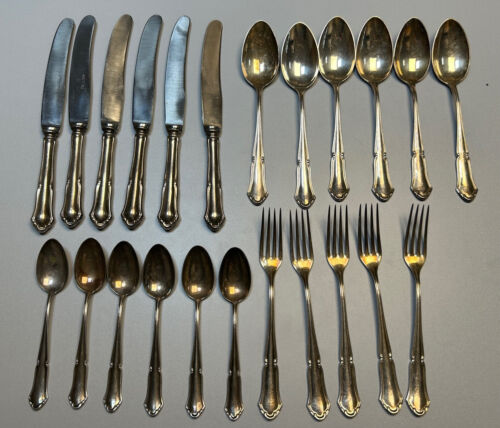
I want to click on spoon in the bottom row, so click(50, 261), click(88, 263), click(125, 269), click(159, 270), click(196, 270), click(238, 277).